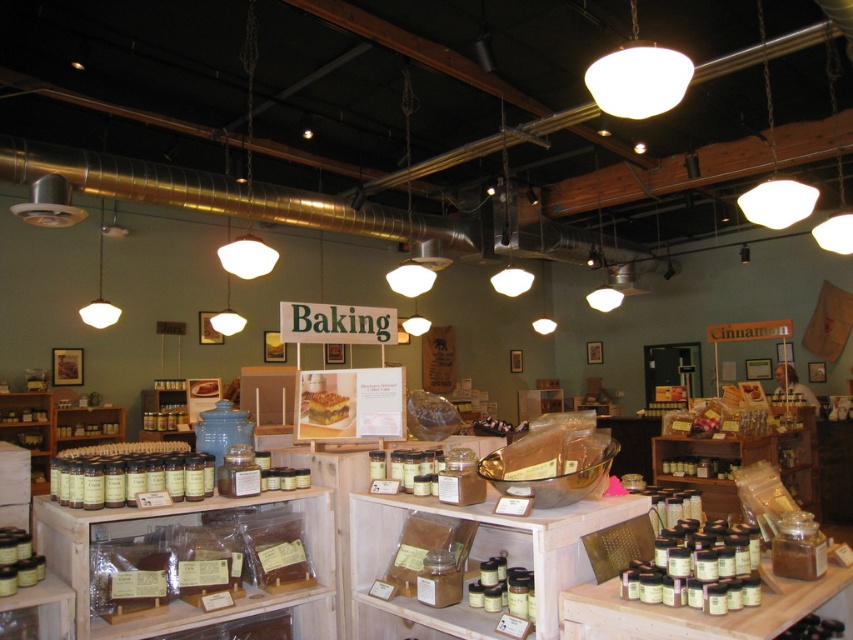
Does wooden shelf at lower left come in front of golden brown cake at center?

Yes, it is in front of golden brown cake at center.

Between wooden shelf at lower left and golden brown cake at center, which one has less height?

With less height is golden brown cake at center.

You are a GUI agent. You are given a task and a screenshot of the screen. Output one action in this format:
    pyautogui.click(x=<x>, y=<y>)
    Task: Click on the wooden shelf at lower left
    
    Given the screenshot: What is the action you would take?
    tap(44, 609)

Which of these two, wooden shelf at lower left or matte wood spice rack at lower left, stands shorter?

With less height is wooden shelf at lower left.

Does point (50, 625) come in front of point (76, 417)?

That is True.

Is point (35, 620) less distant than point (80, 419)?

That is True.

In order to click on wooden shelf at lower left in this screenshot , I will do `click(44, 609)`.

Can you confirm if clear plastic container at center is shorter than golden brown cake at center?

In fact, clear plastic container at center may be taller than golden brown cake at center.

Is clear plastic container at center below golden brown cake at center?

Yes, clear plastic container at center is below golden brown cake at center.

At what (x,y) coordinates should I click in order to perform the action: click on clear plastic container at center. Please return your answer as a coordinate pair (x, y). This screenshot has height=640, width=853. Looking at the image, I should click on (474, 561).

What are the coordinates of `clear plastic container at center` in the screenshot? It's located at (474, 561).